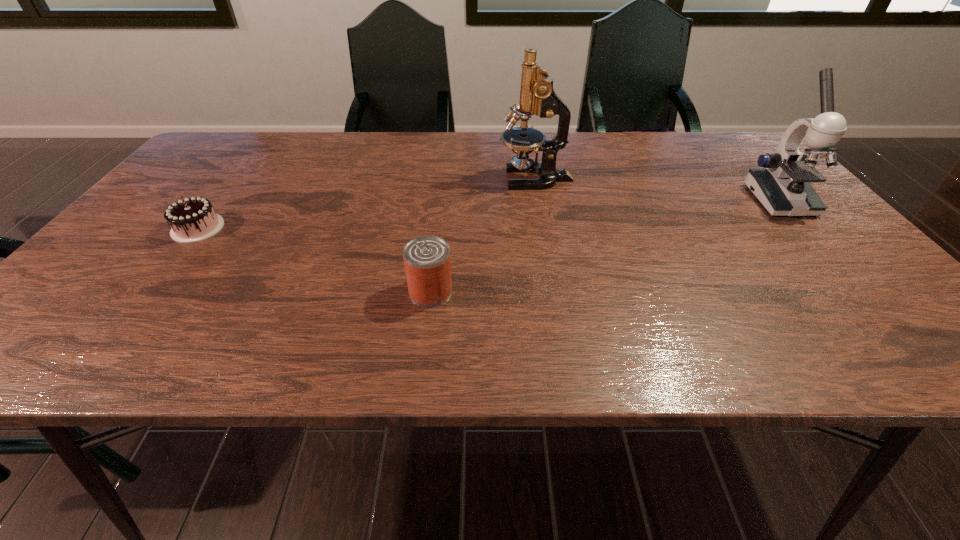
At what (x,y) coordinates should I click in order to perform the action: click on vacant space situated 0.210m on the back of the can. Please return your answer as a coordinate pair (x, y). Looking at the image, I should click on (439, 218).

Locate an element on the screen. vacant space located 0.050m on the left of the shortest object is located at coordinates (153, 228).

The image size is (960, 540). I want to click on object that is at the far edge, so point(537,96).

Identify the location of object that is at the left edge. The height and width of the screenshot is (540, 960). (194, 219).

Find the location of a particular element. The width and height of the screenshot is (960, 540). object that is at the right edge is located at coordinates (782, 186).

I want to click on free location at the far edge of the desktop, so click(454, 140).

In order to click on vacant space at the near edge in this screenshot , I will do `click(324, 332)`.

Where is `free spot at the left edge of the desktop`? Image resolution: width=960 pixels, height=540 pixels. free spot at the left edge of the desktop is located at coordinates (139, 293).

The height and width of the screenshot is (540, 960). What are the coordinates of `vacant area at the right edge of the desktop` in the screenshot? It's located at (813, 227).

You are a GUI agent. You are given a task and a screenshot of the screen. Output one action in this format:
    pyautogui.click(x=<x>, y=<y>)
    Task: Click on the vacant space at the far left corner
    The height and width of the screenshot is (540, 960).
    Given the screenshot: What is the action you would take?
    pyautogui.click(x=239, y=140)